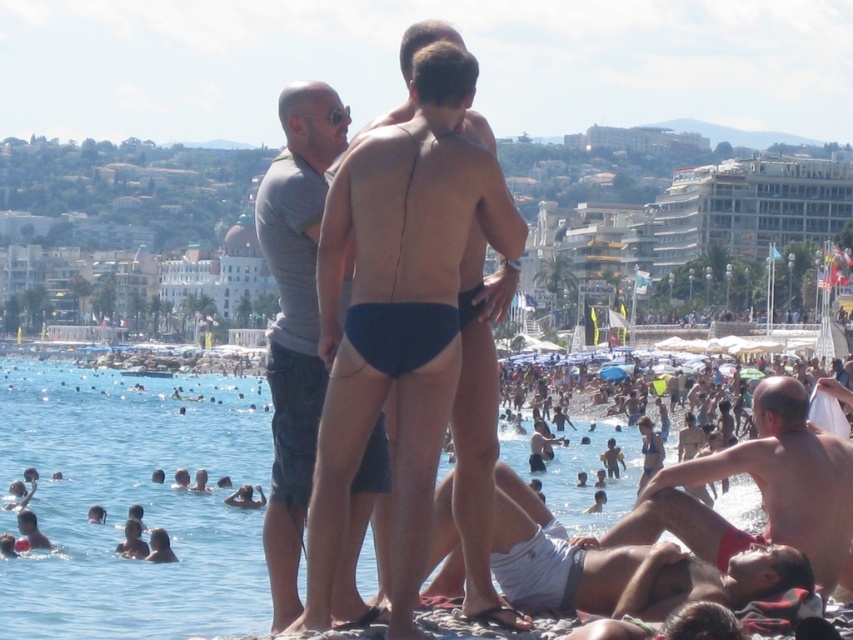
The width and height of the screenshot is (853, 640). Describe the element at coordinates (398, 316) in the screenshot. I see `matte black swim trunks at center` at that location.

Does matte black swim trunks at center have a smaller size compared to gray t-shirt at center?

Yes.

The image size is (853, 640). What do you see at coordinates (398, 316) in the screenshot? I see `matte black swim trunks at center` at bounding box center [398, 316].

Where is `matte black swim trunks at center`? The height and width of the screenshot is (640, 853). matte black swim trunks at center is located at coordinates (398, 316).

Who is positioned more to the right, clear blue water at lower left or white cotton shorts at lower right?

Positioned to the right is white cotton shorts at lower right.

Which of these two, clear blue water at lower left or white cotton shorts at lower right, stands shorter?

Standing shorter between the two is white cotton shorts at lower right.

Which is behind, point (163, 440) or point (779, 550)?

Point (163, 440)

Image resolution: width=853 pixels, height=640 pixels. I want to click on clear blue water at lower left, so click(132, 502).

This screenshot has width=853, height=640. In order to click on clear blue water at lower left in this screenshot , I will do (132, 502).

Who is taller, clear blue water at lower left or matte red shorts at lower right?

clear blue water at lower left is taller.

Which is in front, point (96, 474) or point (779, 452)?

Positioned in front is point (779, 452).

The width and height of the screenshot is (853, 640). What are the coordinates of `clear blue water at lower left` in the screenshot? It's located at (132, 502).